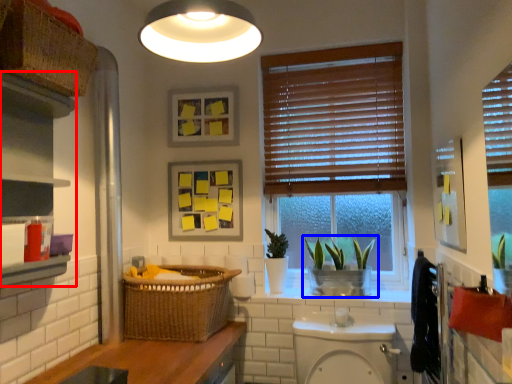
Question: Which object is closer to the camera taking this photo, cabinetry (highlighted by a red box) or houseplant (highlighted by a blue box)?

Choices:
 (A) cabinetry
 (B) houseplant

Answer: (A)